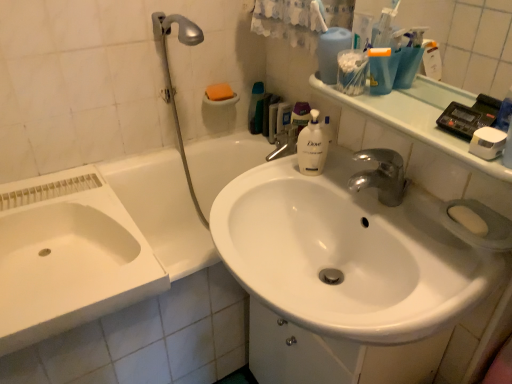
Question: From a real-world perspective, is orange sponge at upper center, the first soap positioned from the left, positioned above or below yellow matte soap at right, arranged as the 1th soap when ordered from the bottom?

Choices:
 (A) above
 (B) below

Answer: (B)

Question: From the image's perspective, is orange sponge at upper center, the second soap from the front, above or below yellow matte soap at right, marked as the 1th soap in a right-to-left arrangement?

Choices:
 (A) below
 (B) above

Answer: (B)

Question: Estimate the real-world distances between objects in this image. Which object is closer to the white glossy sink at lower left, which is counted as the 2th sink, starting from the right?

Choices:
 (A) orange sponge at upper center, the second soap from the front
 (B) yellow matte soap at right, arranged as the second soap when viewed from the left
 (C) white glossy sink at upper right
 (D) white fabric bath towel at upper center
 (E) green plastic bottle at upper center, which is counted as the 1th cleaning product, starting from the left

Answer: (A)

Question: Considering the real-world distances, which object is closest to the orange sponge at upper center, which ranks as the second soap in bottom-to-top order?

Choices:
 (A) white glossy bathtub at lower left
 (B) silver metallic shower head at upper left
 (C) white glossy sink at upper right
 (D) white plastic toothbrush at upper center
 (E) white matte liquid soap at center, which is counted as the 1th cleaning product, starting from the bottom

Answer: (B)